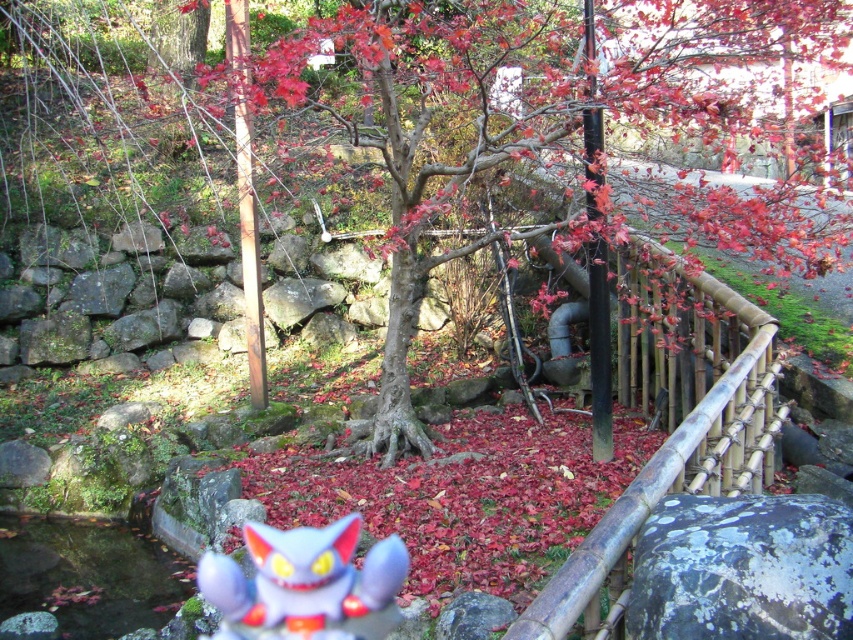
You are planning to place a new decorative item in the Japanese garden scene. The item is 1.2 meters wide. You want to place it near the smooth bark tree at center and the bamboo fence at upper right. Based on their sizes, which object should you place the item closer to?

The smooth bark tree at center is larger in size than the bamboo fence at upper right. Therefore, you should place the item closer to the bamboo fence at upper right to maintain a balanced appearance.

You are a photographer who wants to capture both the smooth bark tree at center and the speckled gray rock at center in the same frame. Based on their positions, which object should you adjust your camera to focus on first to ensure both are in the shot?

You should focus on the smooth bark tree at center first because it is positioned to the left of the speckled gray rock at center, so adjusting the frame to include the leftmost object ensures the rock will also be captured.